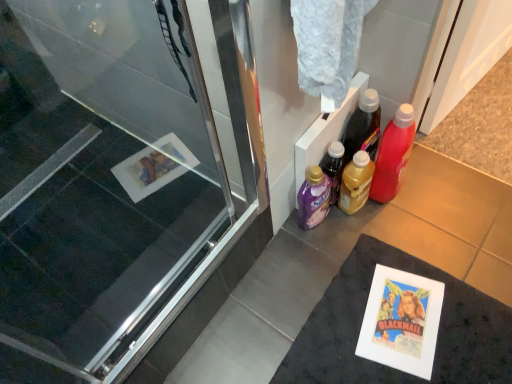
Question: Is white matte bath mat at lower right inside translucent plastic bottle at center-right, positioned as the 2th bottle in left-to-right order?

Choices:
 (A) yes
 (B) no

Answer: (B)

Question: Is translucent plastic bottle at center-right, positioned as the 2th bottle in left-to-right order, outside of white matte bath mat at lower right?

Choices:
 (A) no
 (B) yes

Answer: (B)

Question: Is translucent plastic bottle at center-right, positioned as the 2th bottle in left-to-right order, next to white matte bath mat at lower right and touching it?

Choices:
 (A) no
 (B) yes

Answer: (A)

Question: Does translucent plastic bottle at center-right, arranged as the 2th bottle when viewed from the right, turn towards white matte bath mat at lower right?

Choices:
 (A) no
 (B) yes

Answer: (A)

Question: Considering the relative sizes of translucent plastic bottle at center-right, arranged as the 2th bottle when viewed from the right, and white matte bath mat at lower right in the image provided, is translucent plastic bottle at center-right, arranged as the 2th bottle when viewed from the right, taller than white matte bath mat at lower right?

Choices:
 (A) yes
 (B) no

Answer: (A)

Question: From a real-world perspective, is translucent plastic bottle at center-right, positioned as the 2th bottle in left-to-right order, physically above white matte bath mat at lower right?

Choices:
 (A) yes
 (B) no

Answer: (A)

Question: From the image's perspective, is transparent glass screen door at left located beneath purple plastic bottle at lower center, which is the third bottle in right-to-left order?

Choices:
 (A) no
 (B) yes

Answer: (B)

Question: From a real-world perspective, is transparent glass screen door at left beneath purple plastic bottle at lower center, acting as the first bottle starting from the left?

Choices:
 (A) yes
 (B) no

Answer: (B)

Question: Does transparent glass screen door at left have a smaller size compared to purple plastic bottle at lower center, acting as the first bottle starting from the left?

Choices:
 (A) no
 (B) yes

Answer: (A)

Question: Is the depth of transparent glass screen door at left less than that of purple plastic bottle at lower center, acting as the first bottle starting from the left?

Choices:
 (A) no
 (B) yes

Answer: (B)

Question: Considering the relative sizes of transparent glass screen door at left and purple plastic bottle at lower center, which is the third bottle in right-to-left order, in the image provided, is transparent glass screen door at left wider than purple plastic bottle at lower center, which is the third bottle in right-to-left order,?

Choices:
 (A) yes
 (B) no

Answer: (A)

Question: Is purple plastic bottle at lower center, which is the third bottle in right-to-left order, at the back of transparent glass screen door at left?

Choices:
 (A) no
 (B) yes

Answer: (A)

Question: Can you see transparent glass screen door at left touching translucent plastic bottle at center-right, positioned as the 2th bottle in left-to-right order?

Choices:
 (A) yes
 (B) no

Answer: (B)